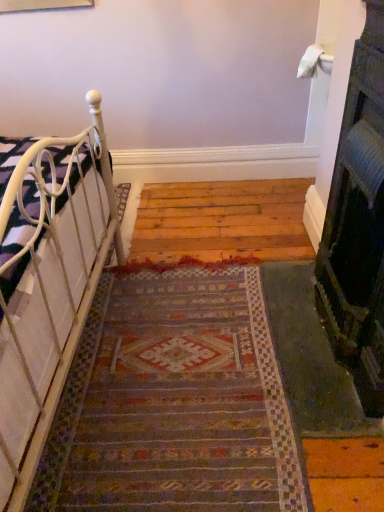
Locate an element on the screen. This screenshot has height=512, width=384. free location to the left of black textured fireplace at right is located at coordinates point(204,345).